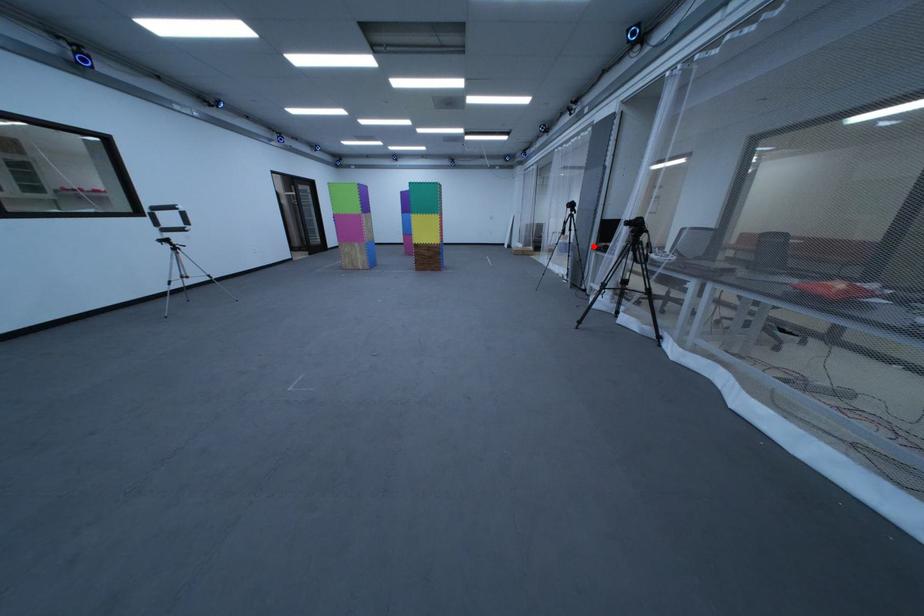
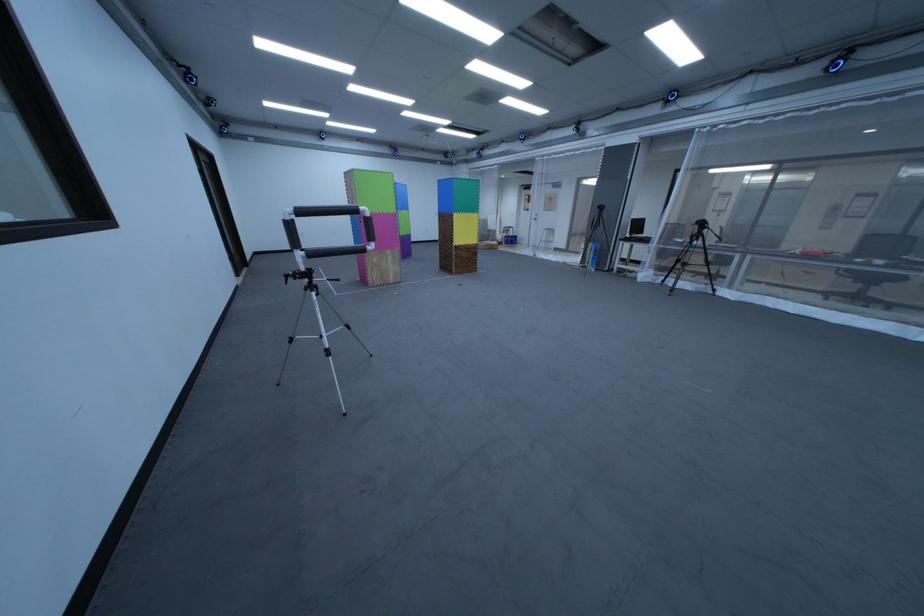
The point at the highlighted location is marked in the first image. Where is the corresponding point in the second image?

(623, 238)